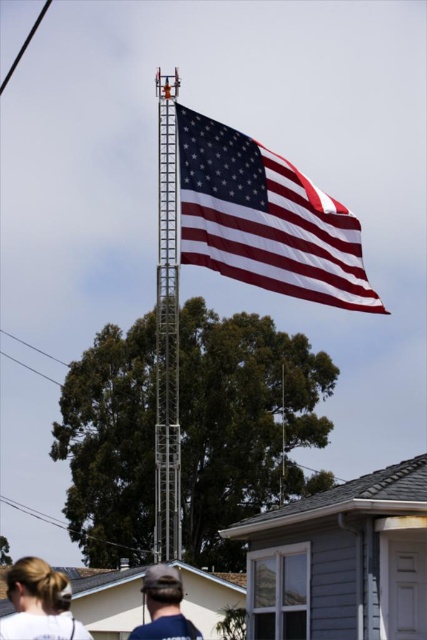
Which is more to the right, polished cotton flag at upper center or blonde hair at lower left?

polished cotton flag at upper center is more to the right.

Does polished cotton flag at upper center have a smaller size compared to blonde hair at lower left?

Indeed, polished cotton flag at upper center has a smaller size compared to blonde hair at lower left.

What do you see at coordinates (265, 220) in the screenshot? I see `polished cotton flag at upper center` at bounding box center [265, 220].

At what (x,y) coordinates should I click in order to perform the action: click on polished cotton flag at upper center. Please return your answer as a coordinate pair (x, y). This screenshot has height=640, width=427. Looking at the image, I should click on (265, 220).

Is polished cotton flag at upper center to the right of blue denim shirt at lower center from the viewer's perspective?

Yes, polished cotton flag at upper center is to the right of blue denim shirt at lower center.

Which is more to the left, polished cotton flag at upper center or blue denim shirt at lower center?

blue denim shirt at lower center

Which is behind, point (243, 244) or point (166, 618)?

Positioned behind is point (243, 244).

The height and width of the screenshot is (640, 427). Identify the location of polished cotton flag at upper center. (265, 220).

Looking at this image, is blonde hair at lower left closer to camera compared to blue denim shirt at lower center?

Yes, blonde hair at lower left is closer to the viewer.

Is blonde hair at lower left further to the viewer compared to blue denim shirt at lower center?

No, blonde hair at lower left is closer to the viewer.

Locate an element on the screen. This screenshot has height=640, width=427. blonde hair at lower left is located at coordinates (38, 604).